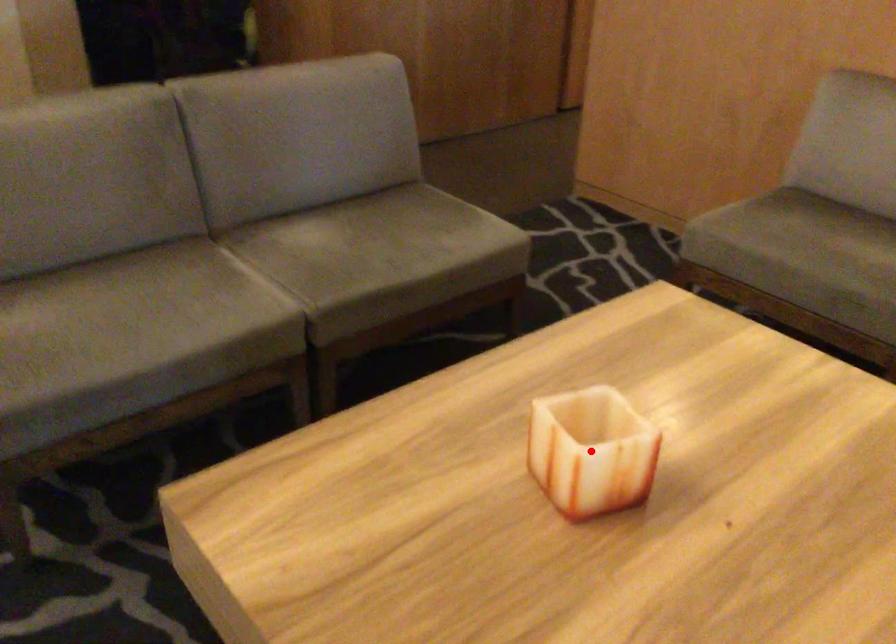
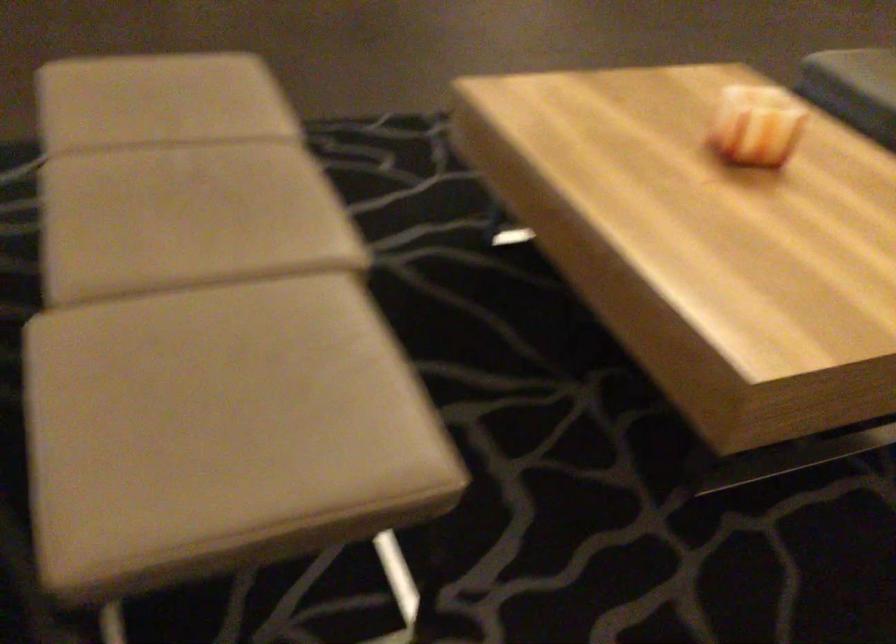
The point at the highlighted location is marked in the first image. Where is the corresponding point in the second image?

(721, 88)